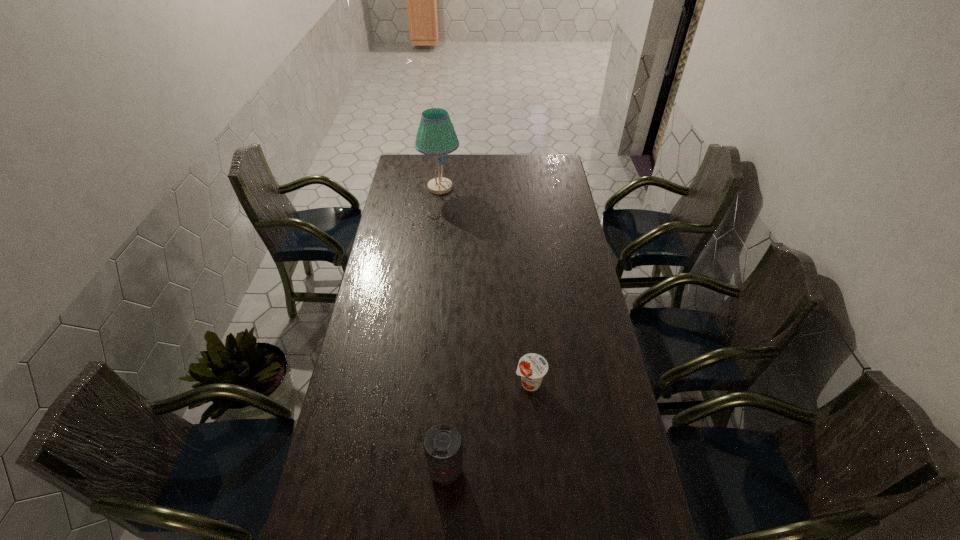
I want to click on the farthest object, so click(436, 136).

What are the coordinates of `lamp` in the screenshot? It's located at (436, 136).

Locate an element on the screen. the second nearest object is located at coordinates (442, 444).

Identify the location of telephoto lens. (442, 444).

What are the coordinates of `the third tallest object` in the screenshot? It's located at (532, 367).

Where is `the left yogurt`? The image size is (960, 540). the left yogurt is located at coordinates (532, 367).

This screenshot has height=540, width=960. Find the location of `vacant space situated on the front of the lamp`. vacant space situated on the front of the lamp is located at coordinates (436, 225).

Identify the location of vacant region located on the side of the third farthest object where the control switches are located. (543, 470).

At what (x,y) coordinates should I click in order to perform the action: click on free space located 0.290m on the front of the second object from right to left. Please return your answer as a coordinate pair (x, y). This screenshot has width=960, height=540. Looking at the image, I should click on (539, 488).

Where is `object that is at the far edge`? This screenshot has width=960, height=540. object that is at the far edge is located at coordinates (436, 136).